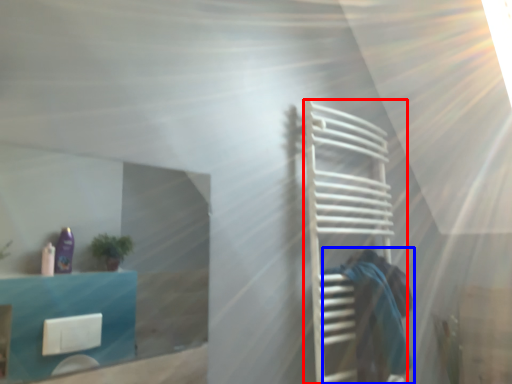
Question: Which object appears closest to the camera in this image, cage (highlighted by a red box) or person (highlighted by a blue box)?

Choices:
 (A) cage
 (B) person

Answer: (A)